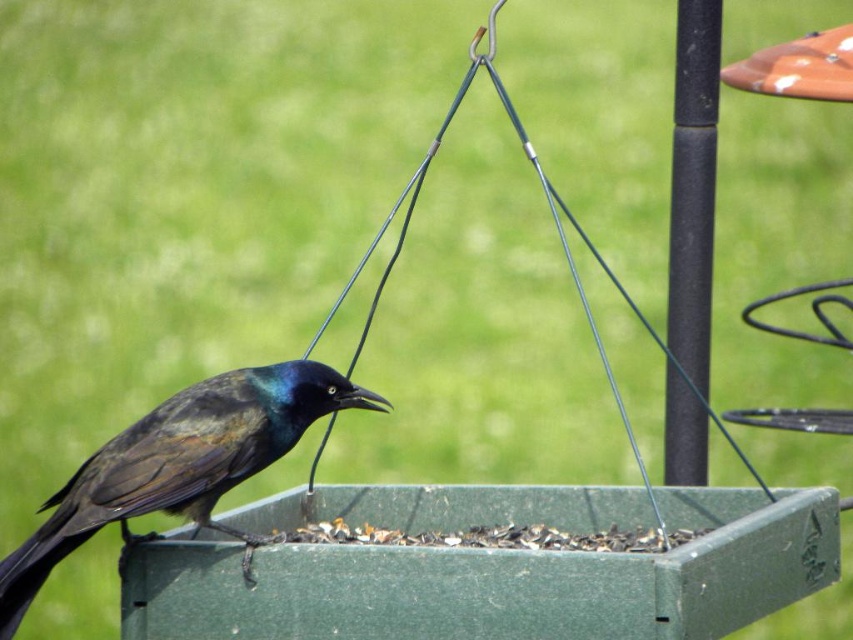
Is the position of shiny black bird at center more distant than that of black matte pole at upper right?

That is False.

Is point (299, 429) positioned after point (672, 204)?

That is False.

Where is `shiny black bird at center`? shiny black bird at center is located at coordinates (180, 465).